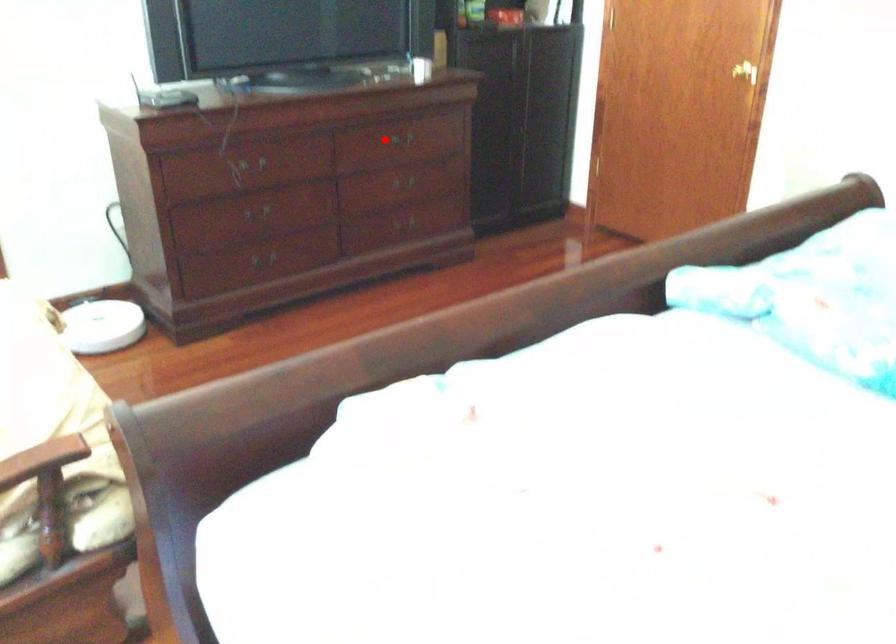
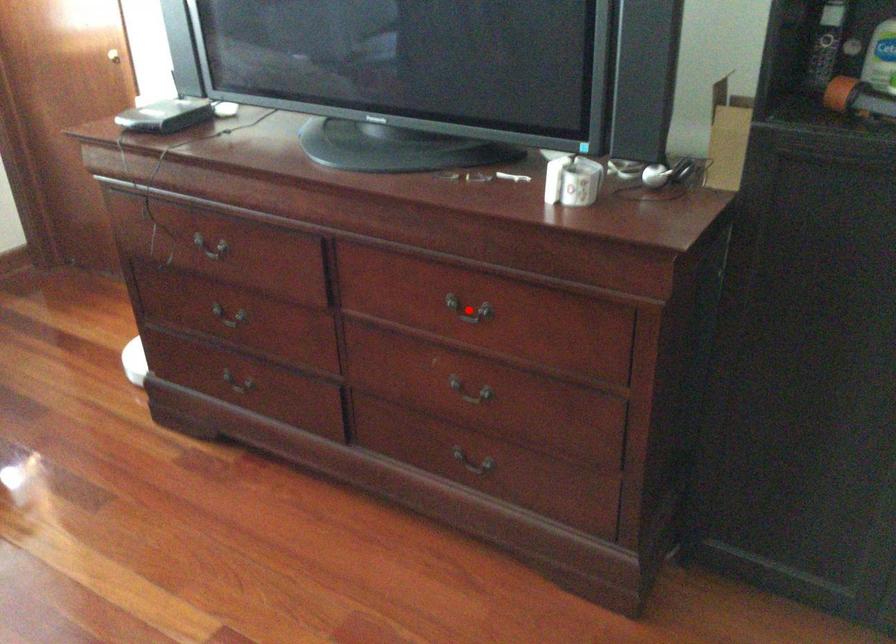
I am providing you with two images of the same scene from different viewpoints. A red point is marked on the first image and another point is marked on the second image. Is the red point in image1 aligned with the point shown in image2?

Yes